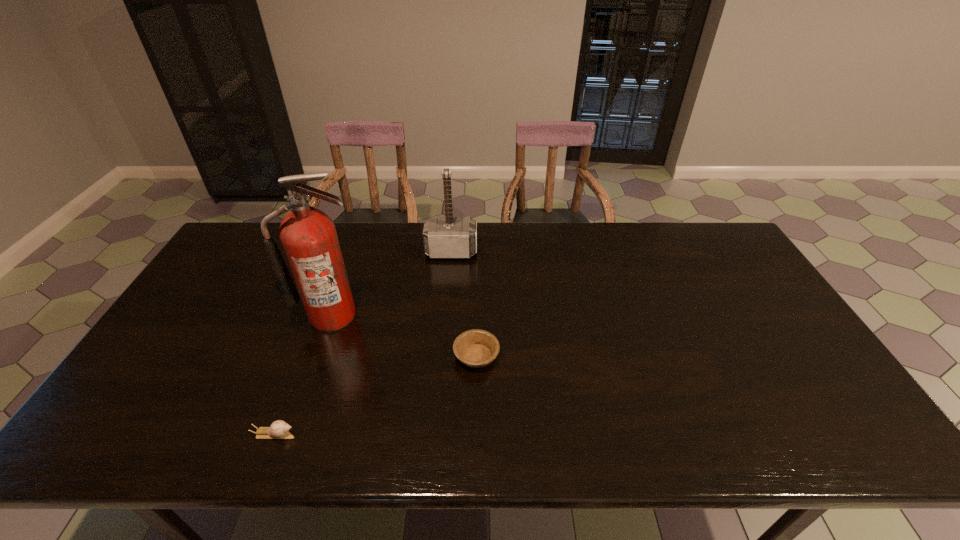
Locate an element on the screen. Image resolution: width=960 pixels, height=540 pixels. object present at the far edge is located at coordinates (444, 237).

Locate an element on the screen. The width and height of the screenshot is (960, 540). object that is at the near edge is located at coordinates (279, 429).

At what (x,y) coordinates should I click in order to perform the action: click on vacant space at the far edge of the desktop. Please return your answer as a coordinate pair (x, y). The width and height of the screenshot is (960, 540). Looking at the image, I should click on (386, 222).

Where is `free space at the near edge of the desktop`? Image resolution: width=960 pixels, height=540 pixels. free space at the near edge of the desktop is located at coordinates (378, 424).

Identify the location of free location at the left edge. The height and width of the screenshot is (540, 960). (181, 331).

In the image, there is a desktop. Where is `vacant space at the right edge`? The image size is (960, 540). vacant space at the right edge is located at coordinates (752, 283).

Where is `free space at the near right corner of the desktop`? free space at the near right corner of the desktop is located at coordinates (855, 450).

The width and height of the screenshot is (960, 540). Identify the location of vacant space that's between the second nearest object and the fire extinguisher. (404, 336).

Find the location of a particular element. This screenshot has height=540, width=960. free space between the escargot and the third nearest object is located at coordinates (303, 375).

Where is `vacant area that lies between the fire extinguisher and the second nearest object`? Image resolution: width=960 pixels, height=540 pixels. vacant area that lies between the fire extinguisher and the second nearest object is located at coordinates (404, 336).